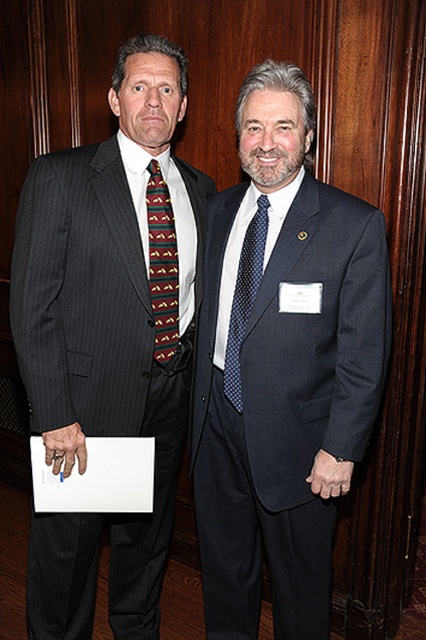
Does dark blue textured suit at center have a larger size compared to pinstriped suit at left?

No.

Is point (255, 172) behind point (158, 400)?

No, it is not.

Between point (198, 458) and point (124, 426), which one is positioned behind?

Positioned behind is point (198, 458).

The image size is (426, 640). I want to click on dark blue textured suit at center, so click(x=282, y=368).

What are the coordinates of `multicolored woven tie at center` in the screenshot? It's located at (161, 266).

Find the location of `multicolored woven tie at center`. multicolored woven tie at center is located at coordinates (161, 266).

Where is `multicolored woven tie at center`? The height and width of the screenshot is (640, 426). multicolored woven tie at center is located at coordinates (161, 266).

Describe the element at coordinates (282, 368) in the screenshot. I see `dark blue textured suit at center` at that location.

Based on the photo, which of these two, dark blue textured suit at center or blue dotted tie at center, stands taller?

dark blue textured suit at center is taller.

Find the location of `dark blue textured suit at center`. dark blue textured suit at center is located at coordinates (282, 368).